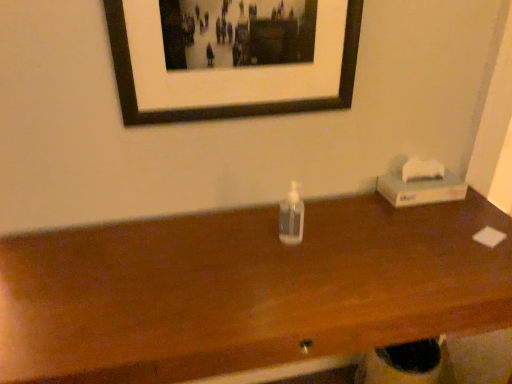
Image resolution: width=512 pixels, height=384 pixels. I want to click on vacant space behind transparent plastic bottle at center, so click(304, 208).